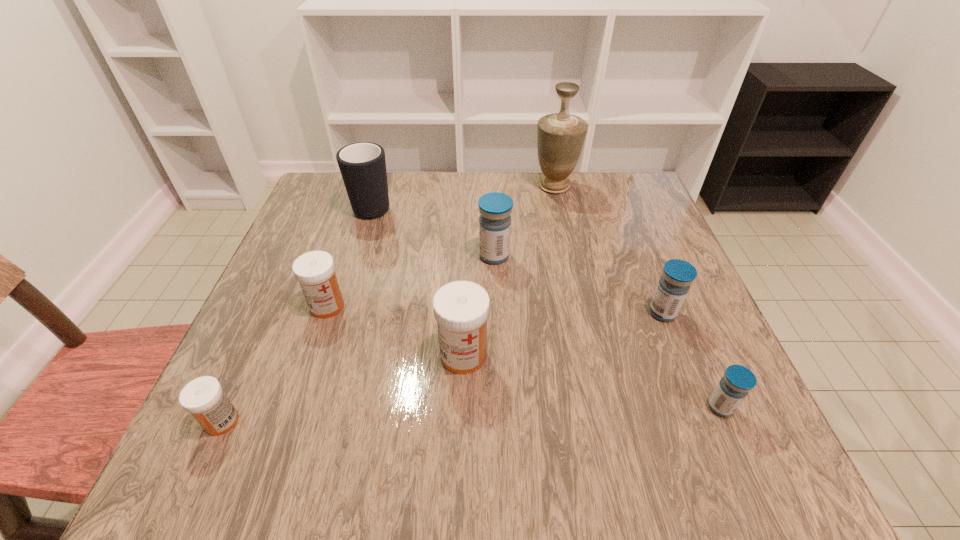
This screenshot has height=540, width=960. I want to click on empty space that is in between the leftmost medicine and the smallest blue medicine, so click(x=471, y=414).

Identify the location of free spot between the second nearest white medicine and the second medicine from left to right. (396, 330).

The height and width of the screenshot is (540, 960). I want to click on free space between the second nearest white medicine and the nearest blue medicine, so click(591, 381).

The width and height of the screenshot is (960, 540). What are the coordinates of `the second closest object to the farthest blue medicine` in the screenshot? It's located at (560, 136).

Point out which object is positioned as the second nearest to the nearest blue medicine. Please provide its 2D coordinates. Your answer should be formatted as a tuple, i.e. [(x, y)], where the tuple contains the x and y coordinates of a point satisfying the conditions above.

[(461, 308)]

You are a GUI agent. You are given a task and a screenshot of the screen. Output one action in this format:
    pyautogui.click(x=<x>, y=<y>)
    Task: Click on the medicine that is the closest to the smallest white medicine
    
    Given the screenshot: What is the action you would take?
    pyautogui.click(x=315, y=271)

Locate an element on the screen. medicine identified as the fourth closest to the leftmost object is located at coordinates (677, 276).

Choose which blue medicine is the nearest neighbor to the tallest object. Please provide its 2D coordinates. Your answer should be formatted as a tuple, i.e. [(x, y)], where the tuple contains the x and y coordinates of a point satisfying the conditions above.

[(495, 208)]

Choose which blue medicine is the second nearest neighbor to the mug. Please provide its 2D coordinates. Your answer should be formatted as a tuple, i.e. [(x, y)], where the tuple contains the x and y coordinates of a point satisfying the conditions above.

[(677, 276)]

Choose which white medicine is the second nearest neighbor to the second medicine from left to right. Please provide its 2D coordinates. Your answer should be formatted as a tuple, i.e. [(x, y)], where the tuple contains the x and y coordinates of a point satisfying the conditions above.

[(461, 308)]